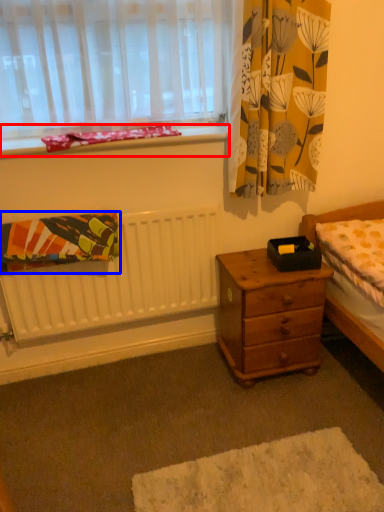
Question: Which of the following is the farthest to the observer, window sill (highlighted by a red box) or blanket (highlighted by a blue box)?

Choices:
 (A) window sill
 (B) blanket

Answer: (A)